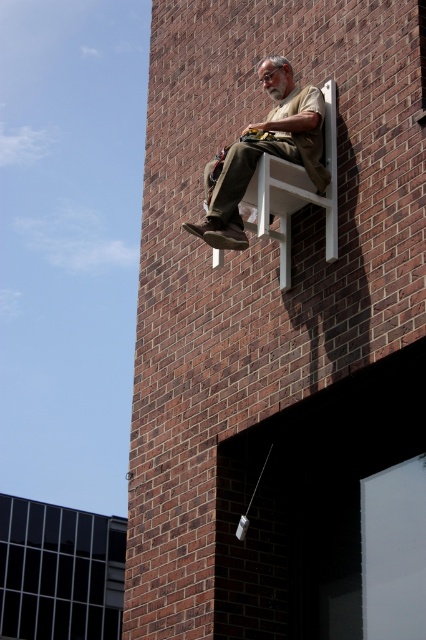
Question: Does clear glass window at lower left come behind khaki cotton pants at upper center?

Choices:
 (A) no
 (B) yes

Answer: (B)

Question: Does clear glass window at lower left come in front of khaki cotton pants at upper center?

Choices:
 (A) no
 (B) yes

Answer: (A)

Question: Is clear glass window at lower left thinner than khaki cotton pants at upper center?

Choices:
 (A) no
 (B) yes

Answer: (A)

Question: Which point is closer to the camera?

Choices:
 (A) (313, 166)
 (B) (13, 566)

Answer: (A)

Question: Which point appears closest to the camera in this image?

Choices:
 (A) (287, 70)
 (B) (16, 554)

Answer: (A)